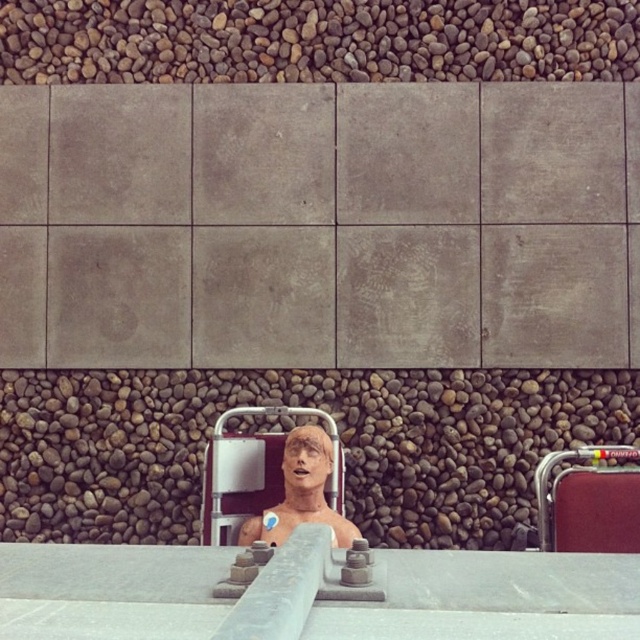
Based on the photo, you are an artist planning to paint the scene. You want to focus on the smooth beige mannequin at center and the brown rough stone at center. Which object should you paint first to ensure proper layering?

You should paint the brown rough stone at center first because the smooth beige mannequin at center is behind it, so painting the stone first allows the mannequin to be layered over it correctly.

You are an artist planning to place a sculpture on a pedestal. The pedestal must support the brown rough stone at center and the smooth beige mannequin at center. Which object should be placed on top to ensure stability?

The brown rough stone at center should be placed on top because it is taller than the smooth beige mannequin at center, providing a stable base for the sculpture.